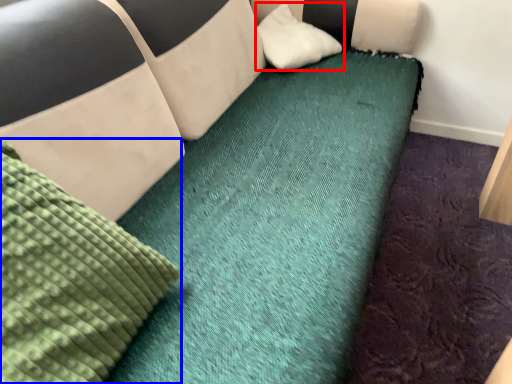
Question: Which object appears closest to the camera in this image, pillow (highlighted by a red box) or mattress (highlighted by a blue box)?

Choices:
 (A) pillow
 (B) mattress

Answer: (B)